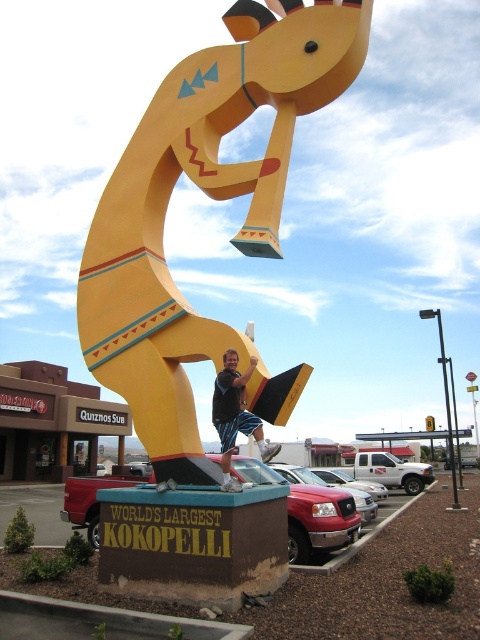
You are standing in front of the yellow matte kokopelli at center. If you walk straight towards it for 15 feet, will you reach the base of the sculpture?

The distance of yellow matte kokopelli at center from viewer is 20.20 feet. After walking 15 feet, you will still be 5.20 feet away from the base of the sculpture.

You are a drone operator trying to capture a photo of the yellow matte kokopelli at center. The drone must hover at point 0.308, 0.438 to get the best shot. Can you confirm if the drone is positioned correctly?

Yes, the yellow matte kokopelli at center is positioned at point [210,196], so the drone is correctly hovering at that coordinate to capture the shot.

You are a tourist visiting the sculpture and want to take a photo of the yellow matte kokopelli at center and the matte black shorts at center. Which object should you focus on first to ensure both are in the frame?

You should focus on the yellow matte kokopelli at center first because it is closer to you than the matte black shorts at center, ensuring both are in the frame.